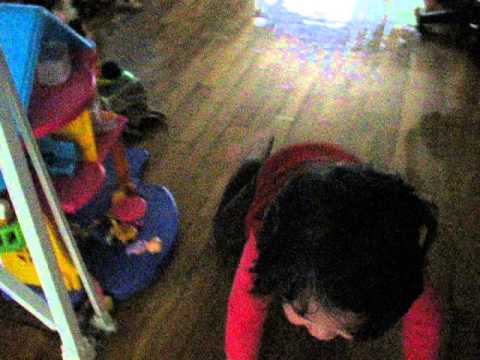
The image size is (480, 360). In order to click on purple lower floor of doll house in this screenshot , I will do pos(130,266).